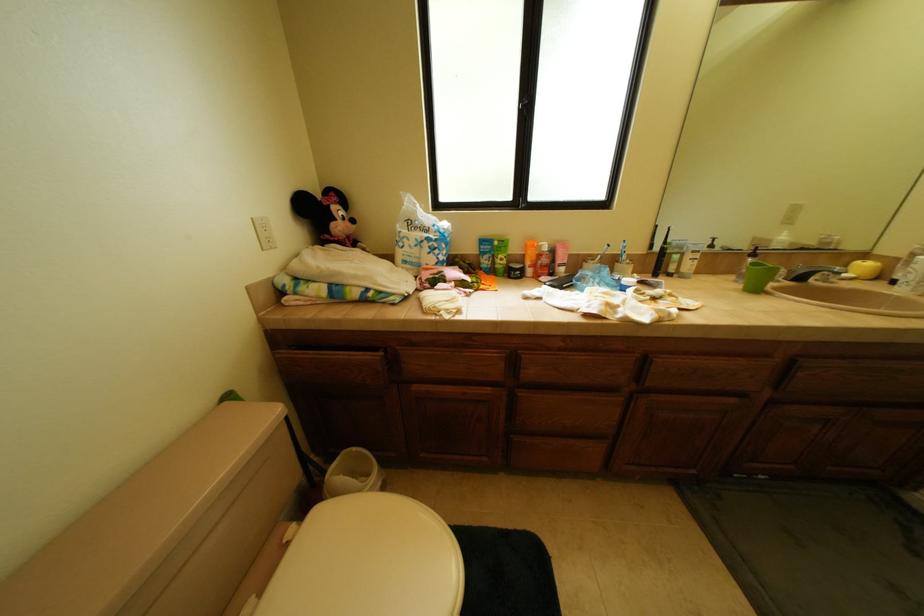
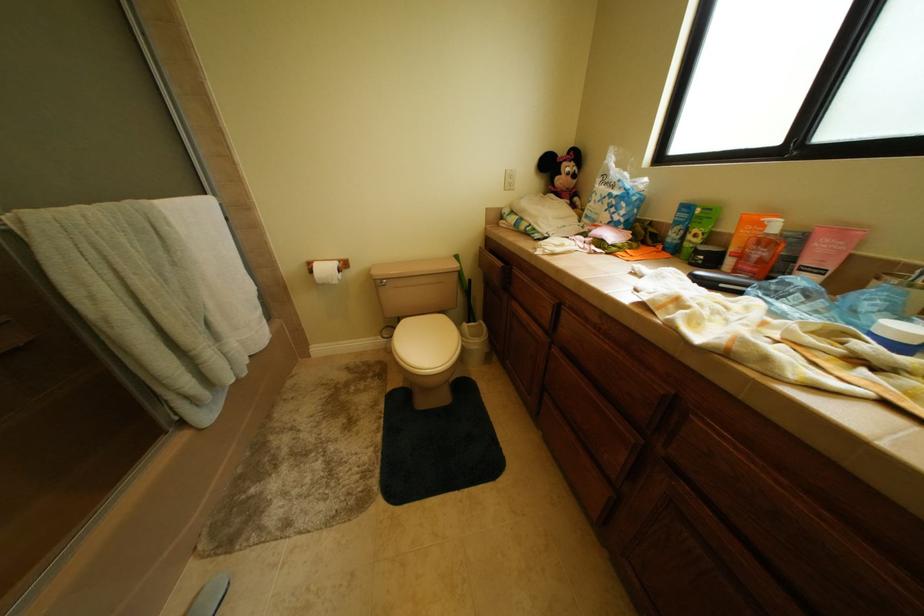
Based on the continuous images, in which direction is the camera rotating?

The camera rotated toward left-down.